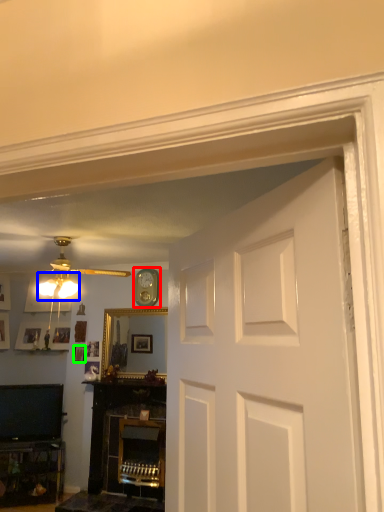
Question: Which object is positioned closest to clock (highlighted by a red box)? Select from lamp (highlighted by a blue box) and picture frame (highlighted by a green box).

Choices:
 (A) lamp
 (B) picture frame

Answer: (B)